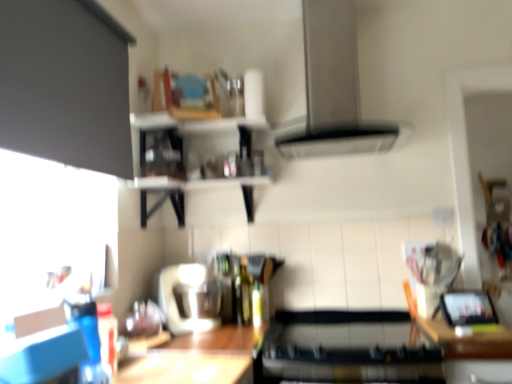
Question: Does green glass bottle at center appear on the left side of wooden table at lower center?

Choices:
 (A) no
 (B) yes

Answer: (A)

Question: From the image's perspective, is green glass bottle at center beneath wooden table at lower center?

Choices:
 (A) no
 (B) yes

Answer: (A)

Question: Is green glass bottle at center smaller than wooden table at lower center?

Choices:
 (A) no
 (B) yes

Answer: (B)

Question: From the image's perspective, does green glass bottle at center appear higher than wooden table at lower center?

Choices:
 (A) yes
 (B) no

Answer: (A)

Question: Does green glass bottle at center lie in front of wooden table at lower center?

Choices:
 (A) yes
 (B) no

Answer: (B)

Question: Is wooden shelves at upper center bigger or smaller than matte black cabinet at upper left?

Choices:
 (A) small
 (B) big

Answer: (B)

Question: Would you say wooden shelves at upper center is to the left or to the right of matte black cabinet at upper left in the picture?

Choices:
 (A) left
 (B) right

Answer: (B)

Question: From the image's perspective, is wooden shelves at upper center positioned above or below matte black cabinet at upper left?

Choices:
 (A) above
 (B) below

Answer: (B)

Question: Considering the positions of wooden shelves at upper center and matte black cabinet at upper left in the image, is wooden shelves at upper center wider or thinner than matte black cabinet at upper left?

Choices:
 (A) thin
 (B) wide

Answer: (B)

Question: Based on their positions, is matte black cabinet at upper left located to the left or right of wooden at right?

Choices:
 (A) right
 (B) left

Answer: (B)

Question: Considering their positions, is matte black cabinet at upper left located in front of or behind wooden at right?

Choices:
 (A) behind
 (B) front

Answer: (B)

Question: Is point (78, 142) closer or farther from the camera than point (421, 319)?

Choices:
 (A) closer
 (B) farther

Answer: (A)

Question: Would you say matte black cabinet at upper left is inside or outside wooden at right?

Choices:
 (A) outside
 (B) inside

Answer: (A)

Question: From the image's perspective, relative to green glass bottle at center, is wooden at right above or below?

Choices:
 (A) above
 (B) below

Answer: (B)

Question: From a real-world perspective, is wooden at right positioned above or below green glass bottle at center?

Choices:
 (A) below
 (B) above

Answer: (A)